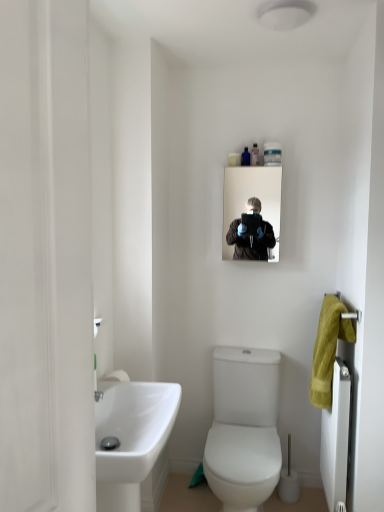
Question: In the image, is white matte screen door at left positioned in front of or behind white glossy toilet at center?

Choices:
 (A) front
 (B) behind

Answer: (A)

Question: Is white matte screen door at left spatially inside white glossy toilet at center, or outside of it?

Choices:
 (A) inside
 (B) outside

Answer: (B)

Question: Estimate the real-world distances between objects in this image. Which object is farther from the white matte screen door at left?

Choices:
 (A) white glossy sink at lower left
 (B) translucent plastic bottle at upper center, which ranks as the second toiletry in right-to-left order
 (C) translucent plastic bottle at upper center, which is counted as the 3th toiletry, starting from the left
 (D) matte black mirror at upper center
 (E) white glossy toilet at center

Answer: (C)

Question: Which is farther from the white matte screen door at left?

Choices:
 (A) translucent plastic bottle at upper center, which ranks as the 3th toiletry in right-to-left order
 (B) translucent plastic bottle at upper center, the first toiletry from the right
 (C) translucent plastic bottle at upper center, positioned as the second toiletry in left-to-right order
 (D) white textured radiator at right
 (E) white glossy toilet at center

Answer: (A)